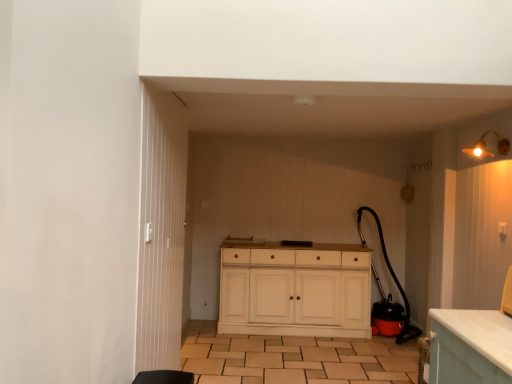
Question: Considering the relative sizes of matte gold light fixture at upper right and white wood cabinet at center in the image provided, is matte gold light fixture at upper right smaller than white wood cabinet at center?

Choices:
 (A) no
 (B) yes

Answer: (B)

Question: Is matte gold light fixture at upper right thinner than white wood cabinet at center?

Choices:
 (A) no
 (B) yes

Answer: (B)

Question: Is matte gold light fixture at upper right facing towards white wood cabinet at center?

Choices:
 (A) no
 (B) yes

Answer: (A)

Question: Is matte gold light fixture at upper right far from white wood cabinet at center?

Choices:
 (A) no
 (B) yes

Answer: (B)

Question: Can you confirm if matte gold light fixture at upper right is shorter than white wood cabinet at center?

Choices:
 (A) no
 (B) yes

Answer: (B)

Question: Is white wooden door at center spatially inside brown tile at center, or outside of it?

Choices:
 (A) inside
 (B) outside

Answer: (B)

Question: Would you say white wooden door at center is to the left or to the right of brown tile at center in the picture?

Choices:
 (A) left
 (B) right

Answer: (A)

Question: Is white wooden door at center taller or shorter than brown tile at center?

Choices:
 (A) short
 (B) tall

Answer: (B)

Question: Considering the positions of white wooden door at center and brown tile at center in the image, is white wooden door at center wider or thinner than brown tile at center?

Choices:
 (A) wide
 (B) thin

Answer: (B)

Question: Does point (484, 152) appear closer or farther from the camera than point (307, 299)?

Choices:
 (A) closer
 (B) farther

Answer: (A)

Question: Looking at their shapes, would you say matte gold light fixture at upper right is wider or thinner than white wood cabinet at center?

Choices:
 (A) thin
 (B) wide

Answer: (A)

Question: Is matte gold light fixture at upper right inside or outside of white wood cabinet at center?

Choices:
 (A) outside
 (B) inside

Answer: (A)

Question: In the image, is matte gold light fixture at upper right on the left side or the right side of white wood cabinet at center?

Choices:
 (A) left
 (B) right

Answer: (B)

Question: From the image's perspective, is white wood cabinet at center above or below brown tile at center?

Choices:
 (A) above
 (B) below

Answer: (A)

Question: Would you say white wood cabinet at center is to the left or to the right of brown tile at center in the picture?

Choices:
 (A) left
 (B) right

Answer: (A)